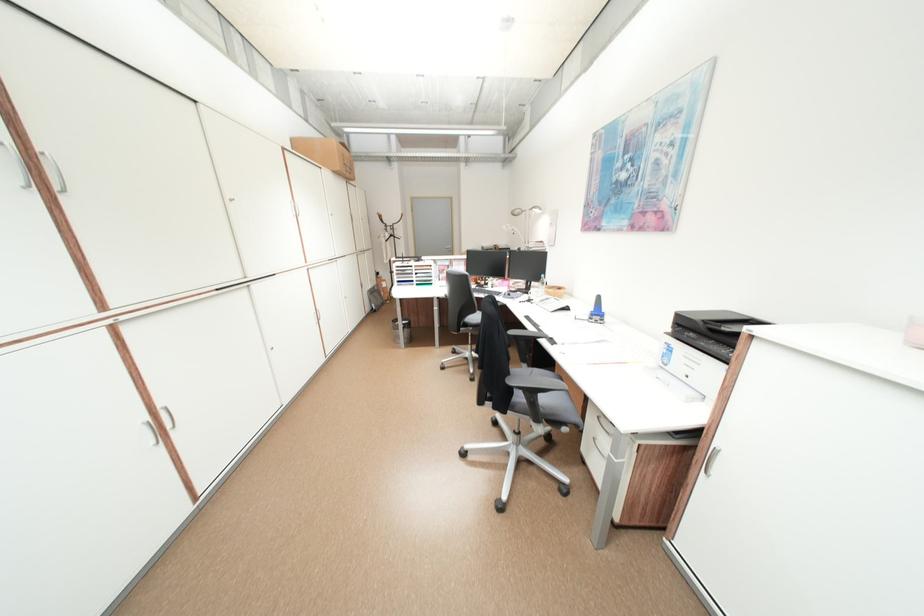
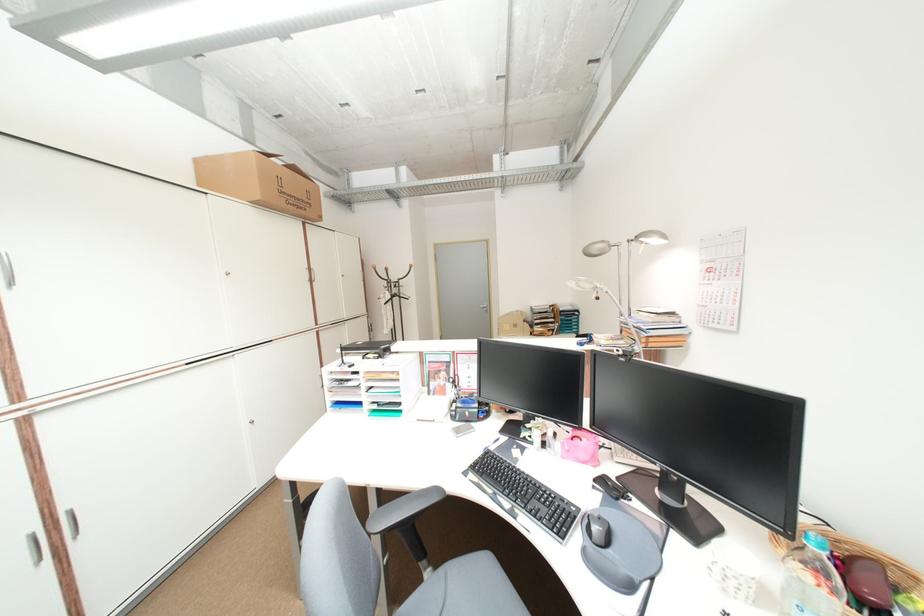
Question: The images are taken continuously from a first-person perspective. In which direction are you moving?

Choices:
 (A) Left
 (B) Right
 (C) Forward
 (D) Backward

Answer: (C)